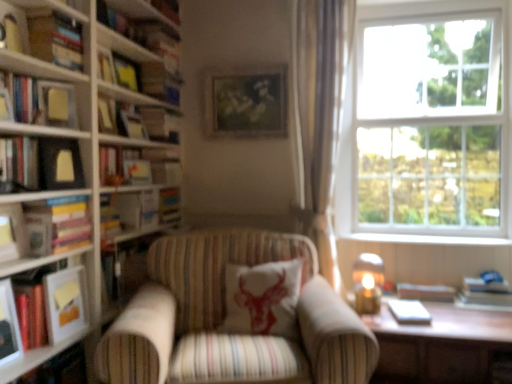
Question: Is the position of matte black picture frame at left, the 4th picture frame positioned from the back, less distant than that of hardcover book at left, marked as the 5th book in a top-to-bottom arrangement?

Choices:
 (A) yes
 (B) no

Answer: (B)

Question: Can you confirm if matte black picture frame at left, which ranks as the third picture frame in right-to-left order, is taller than hardcover book at left, marked as the 5th book in a top-to-bottom arrangement?

Choices:
 (A) no
 (B) yes

Answer: (B)

Question: Is hardcover book at left, which appears as the 3th book when ordered from the bottom, completely or partially inside matte black picture frame at left, which ranks as the third picture frame in right-to-left order?

Choices:
 (A) no
 (B) yes

Answer: (A)

Question: Are matte black picture frame at left, acting as the 2th picture frame starting from the left, and hardcover book at left, which appears as the 3th book when ordered from the bottom, far apart?

Choices:
 (A) no
 (B) yes

Answer: (A)

Question: Considering the relative sizes of matte black picture frame at left, which ranks as the third picture frame in right-to-left order, and hardcover book at left, which appears as the 3th book when ordered from the bottom, in the image provided, is matte black picture frame at left, which ranks as the third picture frame in right-to-left order, bigger than hardcover book at left, which appears as the 3th book when ordered from the bottom,?

Choices:
 (A) yes
 (B) no

Answer: (B)

Question: Is hardcover book at upper left, which ranks as the second book in top-to-bottom order, spatially inside hardcover book at left, which appears as the 3th book when ordered from the bottom, or outside of it?

Choices:
 (A) inside
 (B) outside

Answer: (B)

Question: Is point pos(44,23) closer or farther from the camera than point pos(33,244)?

Choices:
 (A) farther
 (B) closer

Answer: (A)

Question: From a real-world perspective, is hardcover book at upper left, the 6th book in the bottom-to-top sequence, physically located above or below hardcover book at left, marked as the 5th book in a top-to-bottom arrangement?

Choices:
 (A) below
 (B) above

Answer: (B)

Question: Is hardcover book at upper left, which ranks as the second book in top-to-bottom order, in front of or behind hardcover book at left, which appears as the 3th book when ordered from the bottom, in the image?

Choices:
 (A) behind
 (B) front

Answer: (A)

Question: From a real-world perspective, is matte glass candle at right physically located above or below white cotton cushion with red bull at center?

Choices:
 (A) above
 (B) below

Answer: (A)

Question: Based on their sizes in the image, would you say matte glass candle at right is bigger or smaller than white cotton cushion with red bull at center?

Choices:
 (A) small
 (B) big

Answer: (A)

Question: Is matte glass candle at right inside the boundaries of white cotton cushion with red bull at center, or outside?

Choices:
 (A) outside
 (B) inside

Answer: (A)

Question: Considering the positions of matte glass candle at right and white cotton cushion with red bull at center in the image, is matte glass candle at right wider or thinner than white cotton cushion with red bull at center?

Choices:
 (A) thin
 (B) wide

Answer: (A)

Question: Relative to hardcover book at upper left, which ranks as the second book in top-to-bottom order, is wooden table at lower right in front or behind?

Choices:
 (A) behind
 (B) front

Answer: (A)

Question: Considering the positions of wooden table at lower right and hardcover book at upper left, which ranks as the second book in top-to-bottom order, in the image, is wooden table at lower right wider or thinner than hardcover book at upper left, which ranks as the second book in top-to-bottom order,?

Choices:
 (A) thin
 (B) wide

Answer: (B)